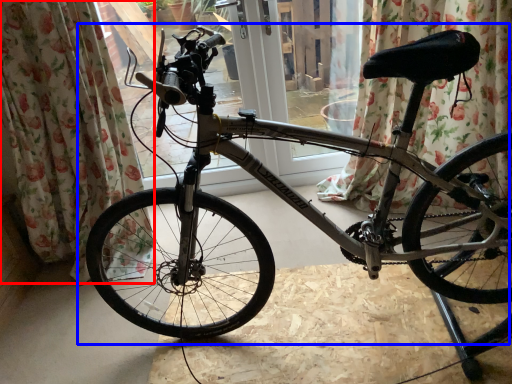
Question: Which of the following is the closest to the observer, curtain (highlighted by a red box) or bicycle (highlighted by a blue box)?

Choices:
 (A) curtain
 (B) bicycle

Answer: (B)